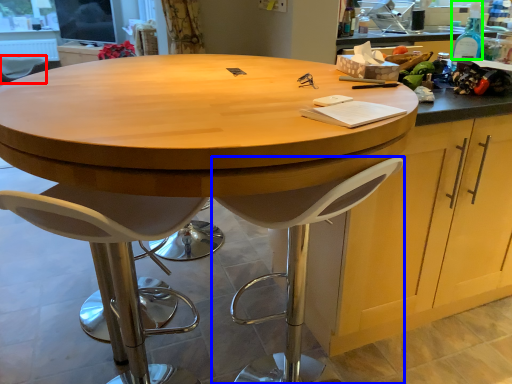
Question: Which is nearer to the chair (highlighted by a red box)? stool (highlighted by a blue box) or bottle (highlighted by a green box).

Choices:
 (A) stool
 (B) bottle

Answer: (A)